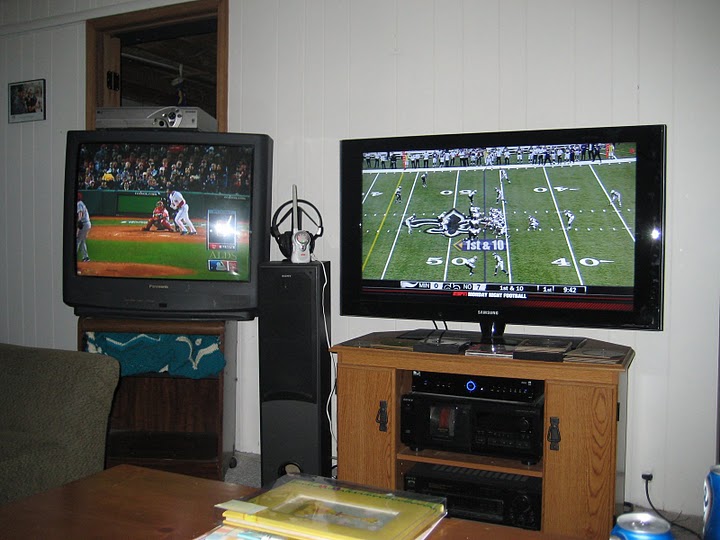
Identify the location of box tv. 168,264.